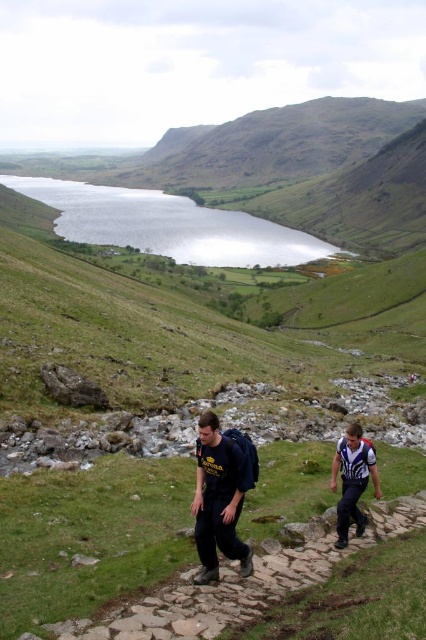
Question: Is reflective glass water at upper center thinner than white fabric shirt at lower right?

Choices:
 (A) yes
 (B) no

Answer: (B)

Question: Which object appears closest to the camera in this image?

Choices:
 (A) green grassy at center
 (B) dark blue backpack at center
 (C) white fabric shirt at lower right

Answer: (A)

Question: Where is green grassy at center located in relation to white fabric shirt at lower right in the image?

Choices:
 (A) above
 (B) below

Answer: (A)

Question: Which object appears farthest from the camera in this image?

Choices:
 (A) dark blue backpack at center
 (B) white fabric shirt at lower right
 (C) green grassy at center

Answer: (B)

Question: Which object is the closest to the green grassy at center?

Choices:
 (A) dark blue backpack at center
 (B) white fabric shirt at lower right
 (C) reflective glass water at upper center

Answer: (A)

Question: Can you confirm if green grassy at center is smaller than white fabric shirt at lower right?

Choices:
 (A) yes
 (B) no

Answer: (B)